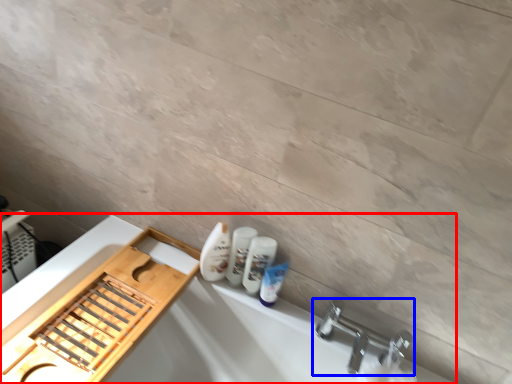
Question: Among these objects, which one is nearest to the camera, bath (highlighted by a red box) or tap (highlighted by a blue box)?

Choices:
 (A) bath
 (B) tap

Answer: (A)